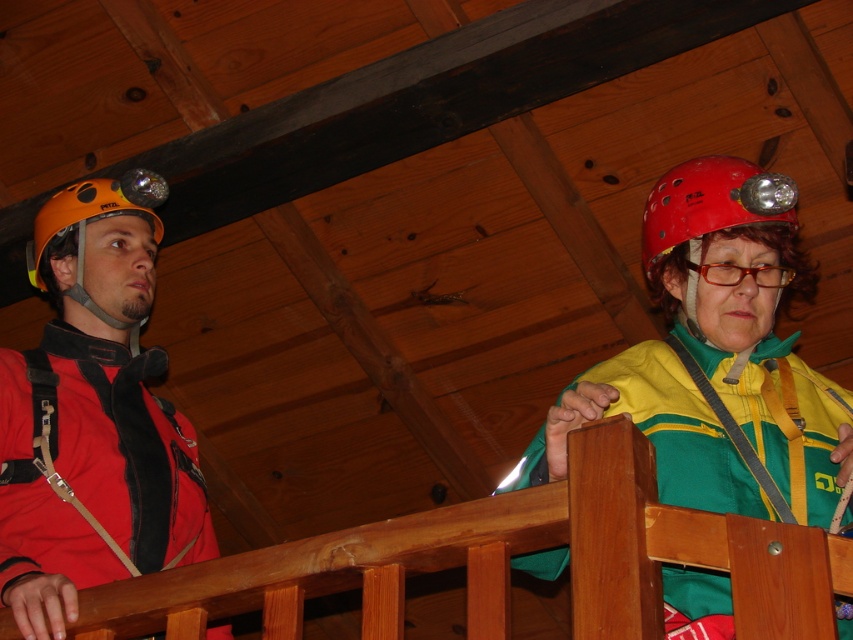
You are an instructor observing two climbers in the wooden climbing facility. You notice the matte orange helmet at left and the red matte helmet at upper right. Which helmet is positioned lower in the image?

The matte orange helmet at left is positioned lower in the image than the red matte helmet at upper right, as it is located below it.

You are standing in front of a wooden climbing wall and see two helmets. Which helmet is positioned to the left of the other? The helmets are the matte orange helmet at left and the red matte helmet at upper right.

The matte orange helmet at left is positioned to the left of the red matte helmet at upper right.

You are standing in front of the climbing wall and see two points marked on it. The first point is at coordinates point (45, 205) and the second is at point (720, 266). Which point is closer to you?

The point at coordinates point (45, 205) is closer to you because it is further to the viewer than point (720, 266).